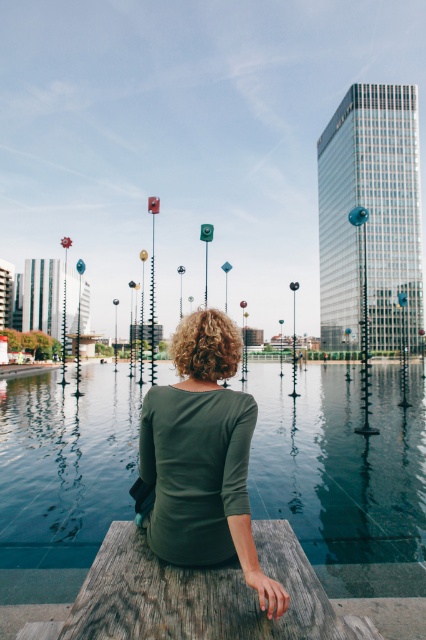
Question: From the image, what is the correct spatial relationship of transparent glass water at center in relation to green matte shirt at center?

Choices:
 (A) right
 (B) left

Answer: (A)

Question: Is transparent glass water at center further to camera compared to green matte shirt at center?

Choices:
 (A) no
 (B) yes

Answer: (B)

Question: Which object appears farthest from the camera in this image?

Choices:
 (A) transparent glass water at center
 (B) green matte shirt at center

Answer: (A)

Question: Is transparent glass water at center positioned in front of green matte shirt at center?

Choices:
 (A) no
 (B) yes

Answer: (A)

Question: Which point is closer to the camera?

Choices:
 (A) green matte shirt at center
 (B) transparent glass water at center

Answer: (A)